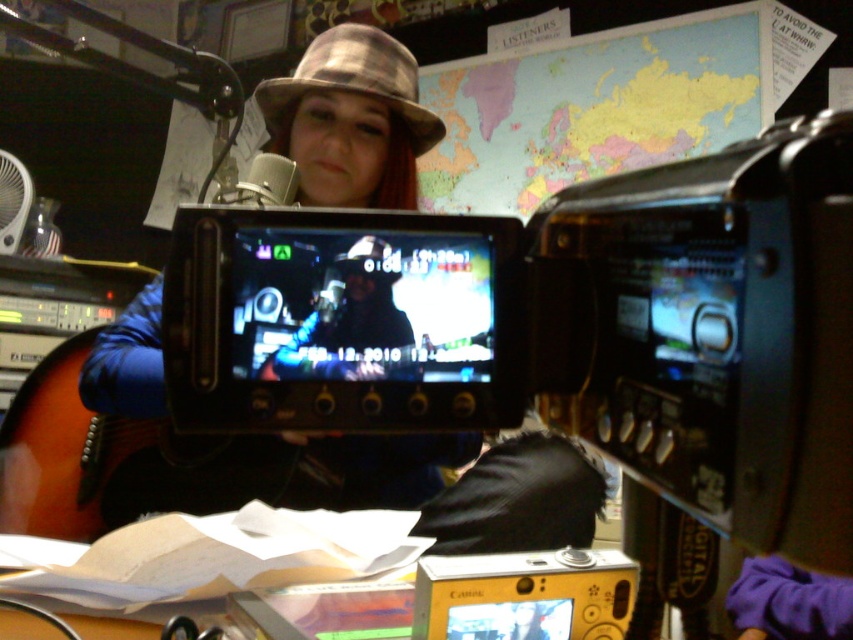
Can you confirm if yellow plastic camera at lower center is positioned below shiny metallic hat at center?

Yes, yellow plastic camera at lower center is below shiny metallic hat at center.

Is yellow plastic camera at lower center thinner than shiny metallic hat at center?

No, yellow plastic camera at lower center is not thinner than shiny metallic hat at center.

Between point (463, 577) and point (384, 244), which one is positioned in front?

Point (384, 244)

Find the location of a particular element. Image resolution: width=853 pixels, height=640 pixels. yellow plastic camera at lower center is located at coordinates (524, 595).

Between point (608, 577) and point (323, 368), which one is positioned behind?

Positioned behind is point (608, 577).

Between point (613, 557) and point (338, 374), which one is positioned behind?

The point (613, 557) is more distant.

You are a GUI agent. You are given a task and a screenshot of the screen. Output one action in this format:
    pyautogui.click(x=<x>, y=<y>)
    Task: Click on the yellow plastic camera at lower center
    
    Given the screenshot: What is the action you would take?
    pyautogui.click(x=524, y=595)

Who is taller, metallic fabric hat at center or shiny metallic hat at center?

Standing taller between the two is metallic fabric hat at center.

Between point (372, 64) and point (344, 257), which one is positioned in front?

Point (344, 257)

You are a GUI agent. You are given a task and a screenshot of the screen. Output one action in this format:
    pyautogui.click(x=<x>, y=<y>)
    Task: Click on the metallic fabric hat at center
    
    Given the screenshot: What is the action you would take?
    pyautogui.click(x=354, y=81)